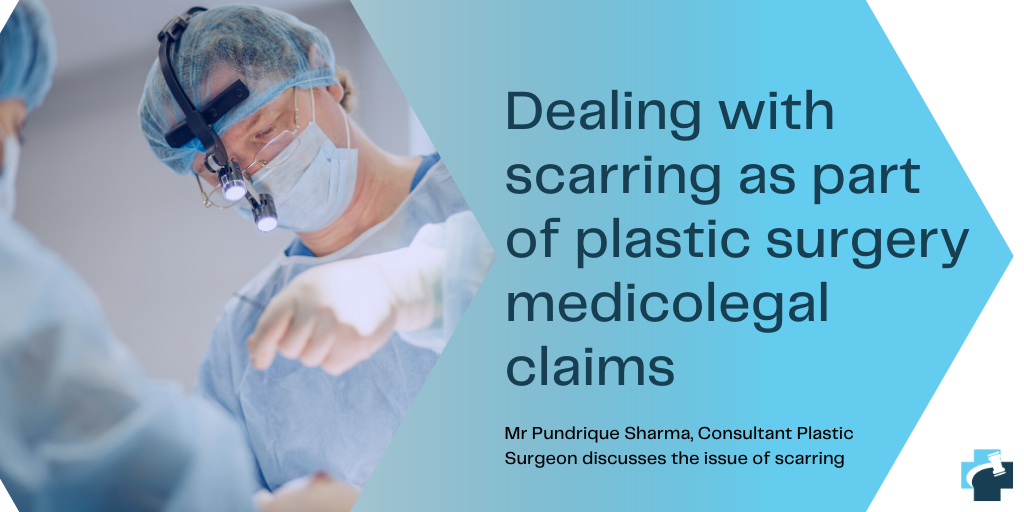
The image size is (1024, 512). In order to click on light in this screenshot , I will do `click(263, 227)`, `click(234, 194)`.